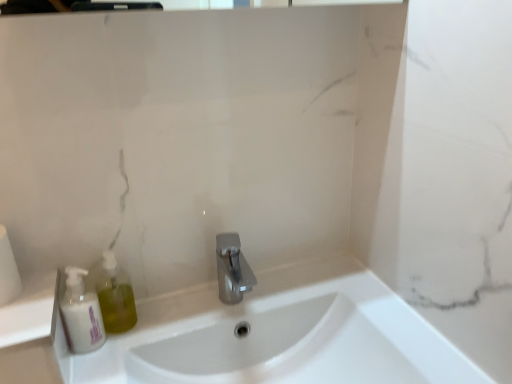
Measure the distance between white matte toilet paper at left and camera.

The distance of white matte toilet paper at left from camera is 26.63 inches.

Locate an element on the screen. white glossy sink at center is located at coordinates (281, 335).

Find the location of `white matte toilet paper at left`. white matte toilet paper at left is located at coordinates tap(8, 271).

How different are the orientations of white matte toilet paper at left and white glossy sink at center in degrees?

The facing directions of white matte toilet paper at left and white glossy sink at center are 2.04 degrees apart.

Considering the relative sizes of white matte toilet paper at left and white glossy sink at center in the image provided, is white matte toilet paper at left wider than white glossy sink at center?

In fact, white matte toilet paper at left might be narrower than white glossy sink at center.

From a real-world perspective, is white matte toilet paper at left on white glossy sink at center?

Yes, from a real-world perspective, white matte toilet paper at left is above white glossy sink at center.

Is point (2, 238) positioned behind point (311, 347)?

That is False.

Is point (401, 333) positioned behind point (230, 237)?

No, (401, 333) is closer to viewer.

Considering the sizes of objects white glossy sink at center and polished metallic faucet at center in the image provided, who is shorter, white glossy sink at center or polished metallic faucet at center?

Standing shorter between the two is polished metallic faucet at center.

Does white glossy sink at center have a lesser width compared to polished metallic faucet at center?

No, white glossy sink at center is not thinner than polished metallic faucet at center.

Choose the correct answer: Is white glossy sink at center inside polished metallic faucet at center or outside it?

white glossy sink at center lies outside polished metallic faucet at center.

From the image's perspective, does white matte toilet paper at left appear higher than white matte bottle at left?

Yes.

Based on the photo, considering the positions of objects white matte toilet paper at left and white matte bottle at left in the image provided, who is behind, white matte toilet paper at left or white matte bottle at left?

Positioned behind is white matte bottle at left.

Could white matte bottle at left be considered to be inside white matte toilet paper at left?

No, white matte bottle at left is not inside white matte toilet paper at left.

Which point is more forward, (2, 254) or (92, 337)?

The point (2, 254) is closer to the camera.

From the image's perspective, is polished metallic faucet at center above or below white matte bottle at left?

From the image's perspective, polished metallic faucet at center appears above white matte bottle at left.

Based on the photo, is polished metallic faucet at center not within white matte bottle at left?

Yes, polished metallic faucet at center is located beyond the bounds of white matte bottle at left.

Consider the image. Is polished metallic faucet at center taller or shorter than white matte bottle at left?

polished metallic faucet at center is shorter than white matte bottle at left.

Does polished metallic faucet at center appear on the right side of white matte bottle at left?

Correct, you'll find polished metallic faucet at center to the right of white matte bottle at left.

How different are the orientations of white matte bottle at left and polished metallic faucet at center in degrees?

The facing directions of white matte bottle at left and polished metallic faucet at center are 0.903 degrees apart.

From the picture: Which object is closer to the camera taking this photo, white matte bottle at left or polished metallic faucet at center?

Positioned in front is white matte bottle at left.

Is white matte bottle at left completely or partially outside of polished metallic faucet at center?

Absolutely, white matte bottle at left is external to polished metallic faucet at center.

Is point (79, 301) positioned behind point (128, 347)?

No, (79, 301) is closer to viewer.

How far apart are white matte bottle at left and white glossy sink at center?

11.62 inches.

In terms of height, does white matte bottle at left look taller or shorter compared to white glossy sink at center?

In the image, white matte bottle at left appears to be shorter than white glossy sink at center.

Is white matte bottle at left turned away from white glossy sink at center?

No, white matte bottle at left is not facing away from white glossy sink at center.

Considering the points (230, 254) and (2, 302), which point is in front, point (230, 254) or point (2, 302)?

The point (2, 302) is closer.

Which object is further away from the camera, polished metallic faucet at center or white matte toilet paper at left?

polished metallic faucet at center.

Can you confirm if polished metallic faucet at center is positioned to the right of white matte toilet paper at left?

Yes.

Locate an element on the screen. The image size is (512, 384). toilet paper that appears on the left of white glossy sink at center is located at coordinates point(8,271).

This screenshot has height=384, width=512. Find the location of `tap above the white glossy sink at center (from a real-world perspective)`. tap above the white glossy sink at center (from a real-world perspective) is located at coordinates (232, 269).

Which object lies nearer to the anchor point white matte bottle at left, white matte toilet paper at left or polished metallic faucet at center?

white matte toilet paper at left is positioned closer to the anchor white matte bottle at left.

Looking at the image, which one is located further to white matte bottle at left, white matte toilet paper at left or white glossy sink at center?

white glossy sink at center is positioned further to the anchor white matte bottle at left.

Based on their spatial positions, is polished metallic faucet at center or white matte bottle at left closer to white matte toilet paper at left?

white matte bottle at left is closer to white matte toilet paper at left.

Considering their positions, is white glossy sink at center positioned closer to white matte bottle at left than white matte toilet paper at left?

Based on the image, white matte toilet paper at left appears to be nearer to white matte bottle at left.

Consider the image. Based on their spatial positions, is white glossy sink at center or polished metallic faucet at center further from white matte toilet paper at left?

The object further to white matte toilet paper at left is white glossy sink at center.

When comparing their distances from polished metallic faucet at center, does white matte toilet paper at left or white matte bottle at left seem closer?

white matte bottle at left is positioned closer to the anchor polished metallic faucet at center.

Which object lies nearer to the anchor point white matte toilet paper at left, polished metallic faucet at center or white glossy sink at center?

Among the two, polished metallic faucet at center is located nearer to white matte toilet paper at left.

Considering their positions, is polished metallic faucet at center positioned further to white matte bottle at left than white glossy sink at center?

white glossy sink at center.

I want to click on tap situated between white matte bottle at left and white glossy sink at center from left to right, so click(x=232, y=269).

This screenshot has height=384, width=512. I want to click on tap between white matte toilet paper at left and white glossy sink at center from left to right, so click(232, 269).

The height and width of the screenshot is (384, 512). I want to click on mouthwash between white matte toilet paper at left and polished metallic faucet at center, so click(81, 314).

Find the location of a particular element. The image size is (512, 384). mouthwash between white matte toilet paper at left and white glossy sink at center is located at coordinates (81, 314).